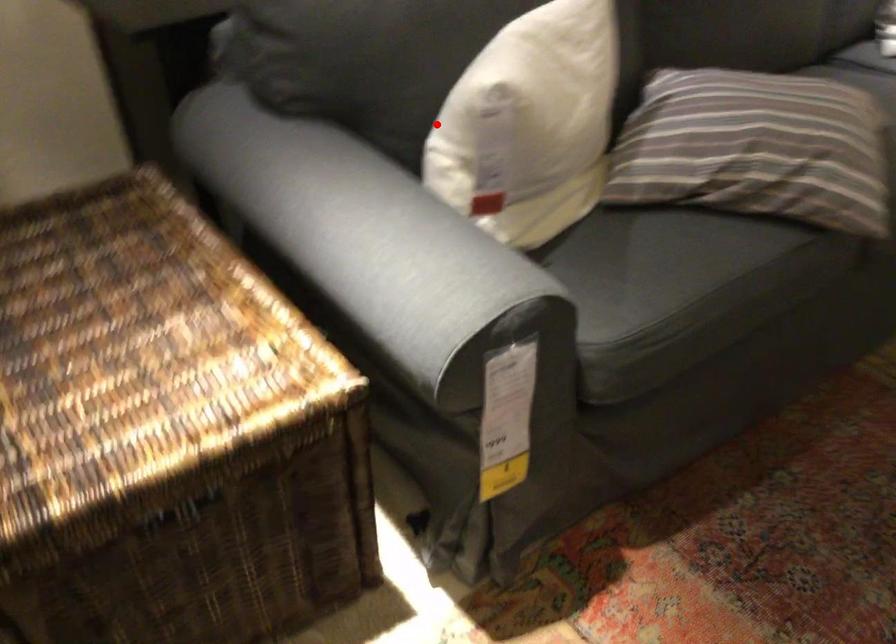
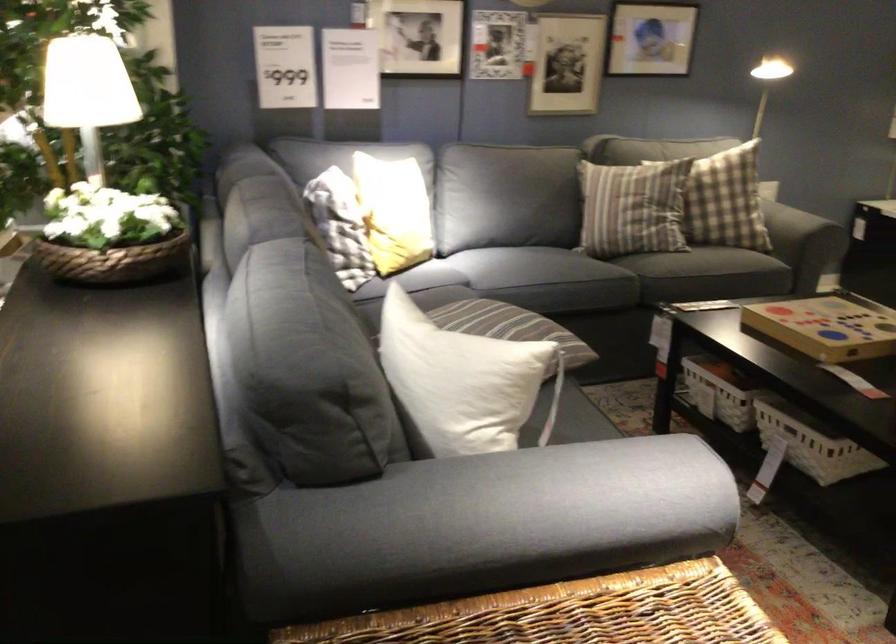
Find the pixel in the second image that matches the highlighted location in the first image.

(462, 381)